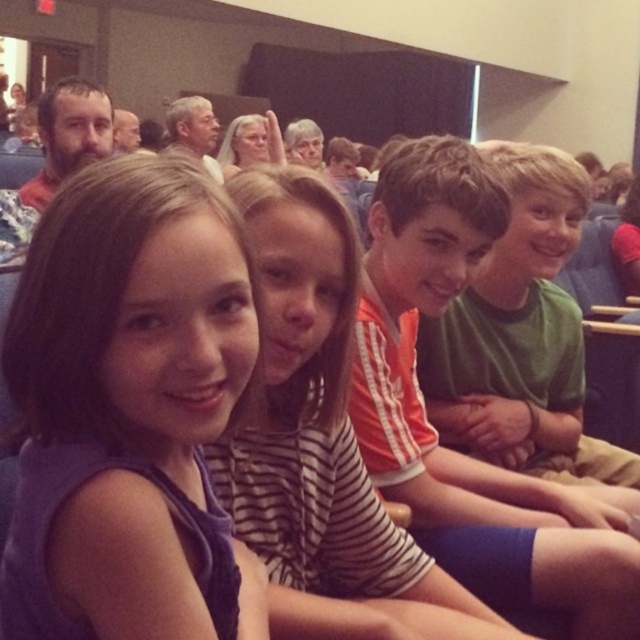
Does point (515, 467) come farther from viewer compared to point (72, 81)?

No, (515, 467) is in front of (72, 81).

Which is in front, point (515, 184) or point (67, 100)?

Point (515, 184)

Is point (499, 417) in front of point (104, 115)?

Yes, point (499, 417) is in front of point (104, 115).

Where is `green matte shirt at center`? green matte shirt at center is located at coordinates pyautogui.click(x=522, y=337).

Can you confirm if green matte shirt at center is smaller than matte black beard at upper left?

Incorrect, green matte shirt at center is not smaller in size than matte black beard at upper left.

From the picture: Between green matte shirt at center and matte black beard at upper left, which one is positioned higher?

matte black beard at upper left is higher up.

Locate an element on the screen. green matte shirt at center is located at coordinates (522, 337).

Find the location of a particular element. green matte shirt at center is located at coordinates (522, 337).

Can you confirm if striped shirt at center is positioned to the left of green matte shirt at center?

Yes, striped shirt at center is to the left of green matte shirt at center.

Between striped shirt at center and green matte shirt at center, which one is positioned higher?

Positioned higher is green matte shirt at center.

Image resolution: width=640 pixels, height=640 pixels. I want to click on striped shirt at center, so click(x=321, y=424).